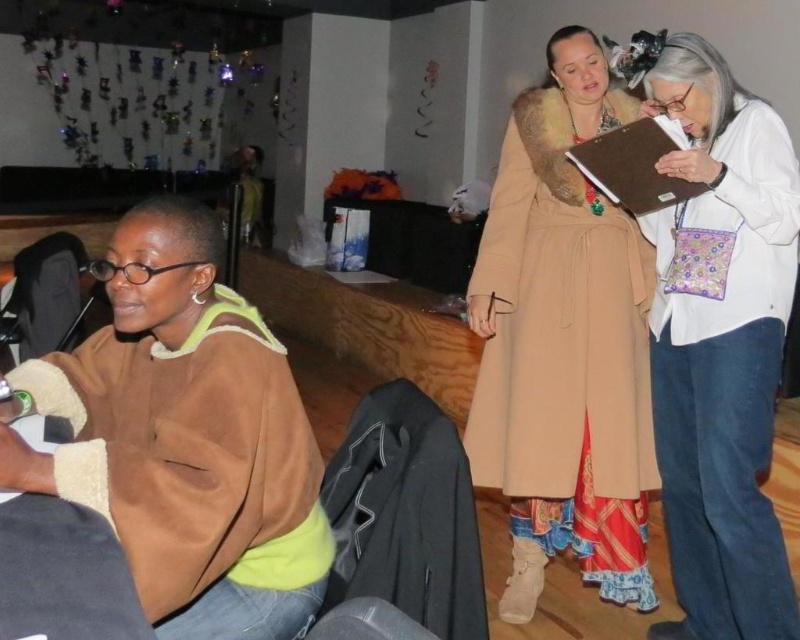
Question: Which object appears farthest from the camera in this image?

Choices:
 (A) suede brown sweater at lower left
 (B) brown paper clipboard at upper right
 (C) white cotton purse at right
 (D) beige wool coat at center

Answer: (D)

Question: Is beige wool coat at center behind brown paper clipboard at upper right?

Choices:
 (A) yes
 (B) no

Answer: (A)

Question: Which point is closer to the camera?

Choices:
 (A) brown paper clipboard at upper right
 (B) beige wool coat at center
 (C) white cotton purse at right

Answer: (C)

Question: Is beige wool coat at center to the right of white cotton purse at right from the viewer's perspective?

Choices:
 (A) no
 (B) yes

Answer: (A)

Question: Can you confirm if beige wool coat at center is thinner than white cotton purse at right?

Choices:
 (A) no
 (B) yes

Answer: (A)

Question: Which of the following is the farthest from the observer?

Choices:
 (A) (649, 113)
 (B) (134, 429)
 (C) (580, 161)

Answer: (C)